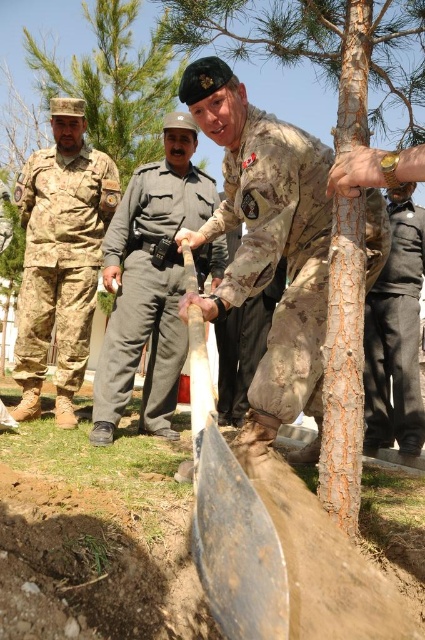
Question: Which point is farther to the camera?

Choices:
 (A) camouflage fabric uniform at left
 (B) camouflage fabric uniform at center
 (C) dark gray cotton pants at center

Answer: (A)

Question: Which of these objects is positioned closest to the gray cotton shirt at center?

Choices:
 (A) dark gray cotton pants at center
 (B) rough bark tree at center

Answer: (B)

Question: Can you confirm if gray cotton shirt at center is positioned to the right of green textured tree at center?

Choices:
 (A) yes
 (B) no

Answer: (A)

Question: Which object is the closest to the gray cotton shirt at center?

Choices:
 (A) camouflage fabric uniform at left
 (B) green textured tree at center

Answer: (A)

Question: From the image, what is the correct spatial relationship of rough bark tree at center in relation to rusty metal shovel at center?

Choices:
 (A) above
 (B) below

Answer: (A)

Question: Is camouflage fabric uniform at left smaller than rusty metal shovel at center?

Choices:
 (A) yes
 (B) no

Answer: (A)